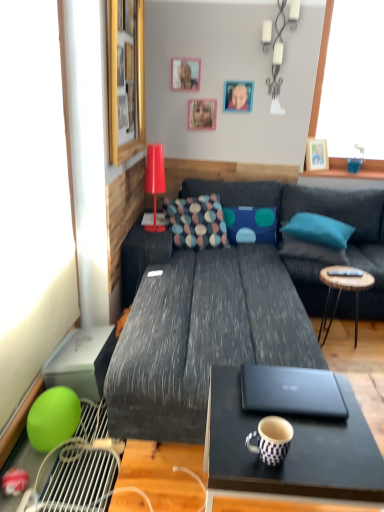
Find the location of a particular element. This screenshot has height=512, width=384. free space in front of black matte laptop at lower center is located at coordinates (316, 452).